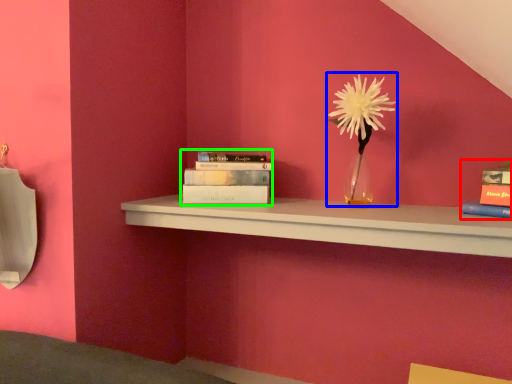
Question: Estimate the real-world distances between objects in this image. Which object is farther from book (highlighted by a red box), floral arrangement (highlighted by a blue box) or book (highlighted by a green box)?

Choices:
 (A) floral arrangement
 (B) book

Answer: (B)